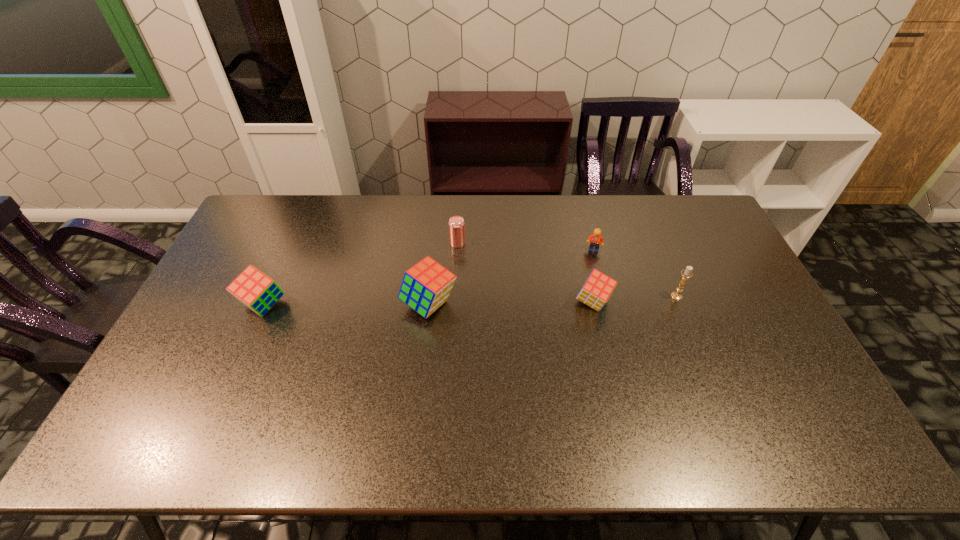
What are the coordinates of `free space between the second cube from right to left and the rightmost object` in the screenshot? It's located at (553, 300).

This screenshot has height=540, width=960. In order to click on free spot between the Lego and the second cube from left to right in this screenshot , I will do `click(512, 277)`.

At what (x,y) coordinates should I click in order to perform the action: click on empty location between the Lego and the second cube from right to left. Please return your answer as a coordinate pair (x, y). Looking at the image, I should click on (512, 277).

This screenshot has width=960, height=540. What are the coordinates of `vacant space that is in between the candle holder and the shortest cube` in the screenshot? It's located at (635, 299).

Locate an element on the screen. unoccupied position between the leftmost object and the second cube from left to right is located at coordinates (347, 305).

This screenshot has width=960, height=540. I want to click on empty space between the second cube from right to left and the shortest cube, so click(511, 303).

The image size is (960, 540). Identify the location of empty space that is in between the beer can and the rightmost cube. (525, 273).

Find the location of a particular element. The image size is (960, 540). free area in between the shortest cube and the second cube from right to left is located at coordinates (511, 303).

The image size is (960, 540). I want to click on object that is the fifth closest one to the leftmost cube, so click(x=687, y=273).

Identify which object is located as the fourth nearest to the leftmost cube. Please provide its 2D coordinates. Your answer should be formatted as a tuple, i.e. [(x, y)], where the tuple contains the x and y coordinates of a point satisfying the conditions above.

[(596, 238)]